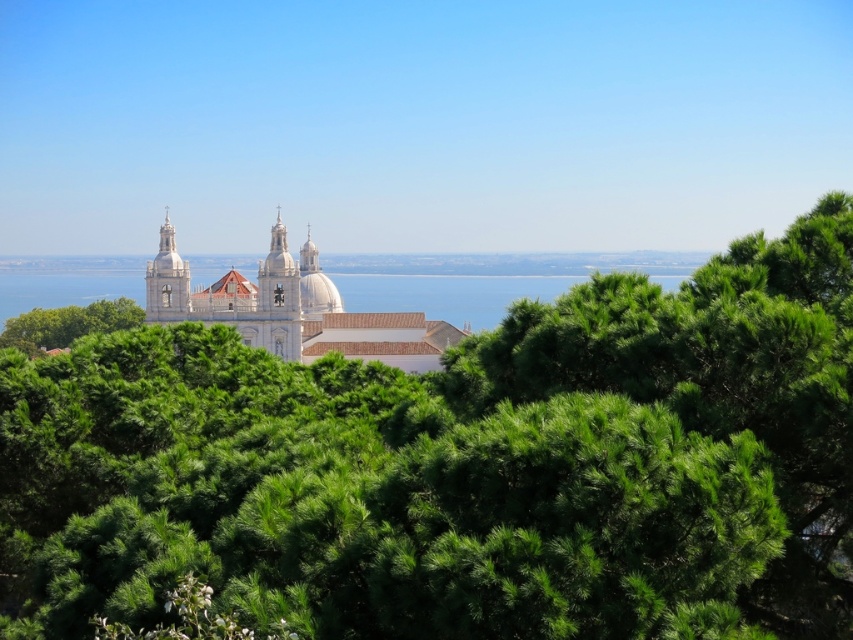
Is green leafy tree at center thinner than white smooth church at center?

No.

Between green leafy tree at center and white smooth church at center, which one is positioned lower?

green leafy tree at center is below.

Is point (846, 250) less distant than point (274, 248)?

Yes, point (846, 250) is in front of point (274, 248).

Image resolution: width=853 pixels, height=640 pixels. In order to click on green leafy tree at center in this screenshot , I will do `click(461, 467)`.

Between green leafy tree at center and blue water at center, which one appears on the left side from the viewer's perspective?

blue water at center

Between green leafy tree at center and blue water at center, which one appears on the right side from the viewer's perspective?

green leafy tree at center is more to the right.

The width and height of the screenshot is (853, 640). Identify the location of green leafy tree at center. (461, 467).

Does green leafy tree at center have a greater height compared to green leafy tree at lower left?

Indeed, green leafy tree at center has a greater height compared to green leafy tree at lower left.

Measure the distance between green leafy tree at center and camera.

The distance of green leafy tree at center from camera is 422.06 feet.

Where is `green leafy tree at center`? green leafy tree at center is located at coordinates (461, 467).